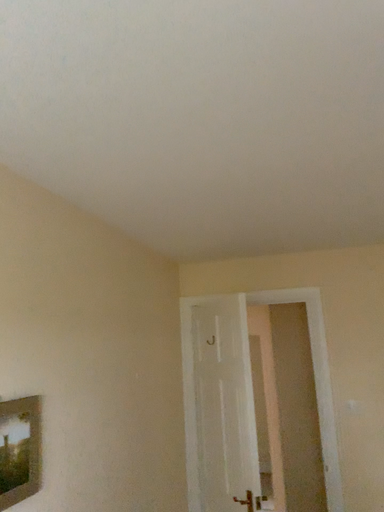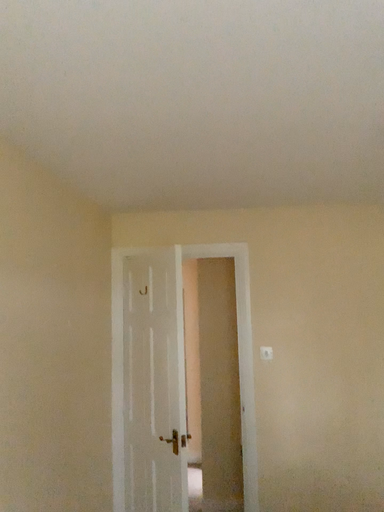
Question: How did the camera likely rotate when shooting the video?

Choices:
 (A) rotated upward
 (B) rotated downward

Answer: (B)